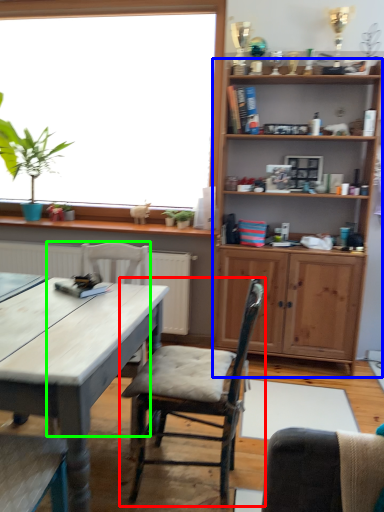
Question: Based on their relative distances, which object is farther from chair (highlighted by a red box)? Choose from shelf (highlighted by a blue box) and chair (highlighted by a green box).

Choices:
 (A) shelf
 (B) chair

Answer: (A)